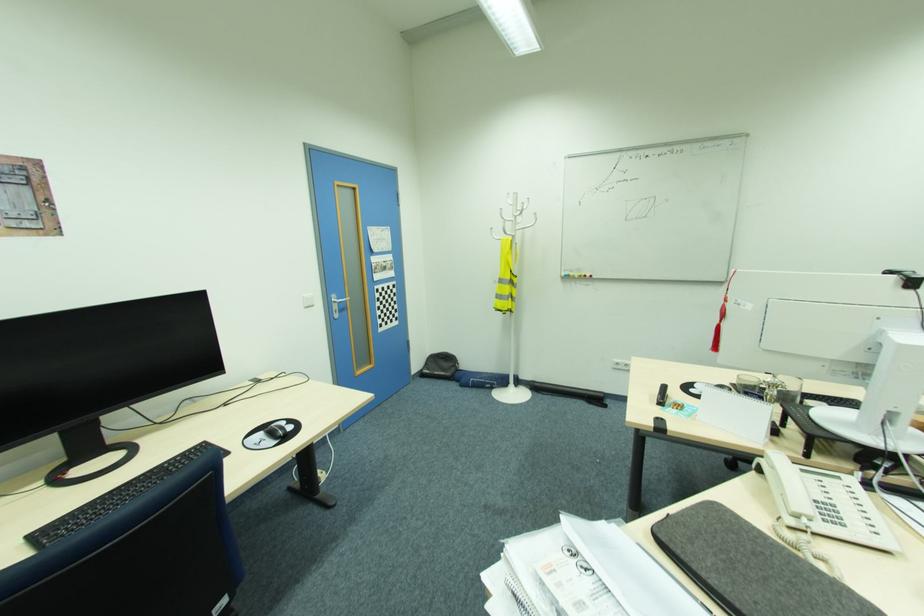
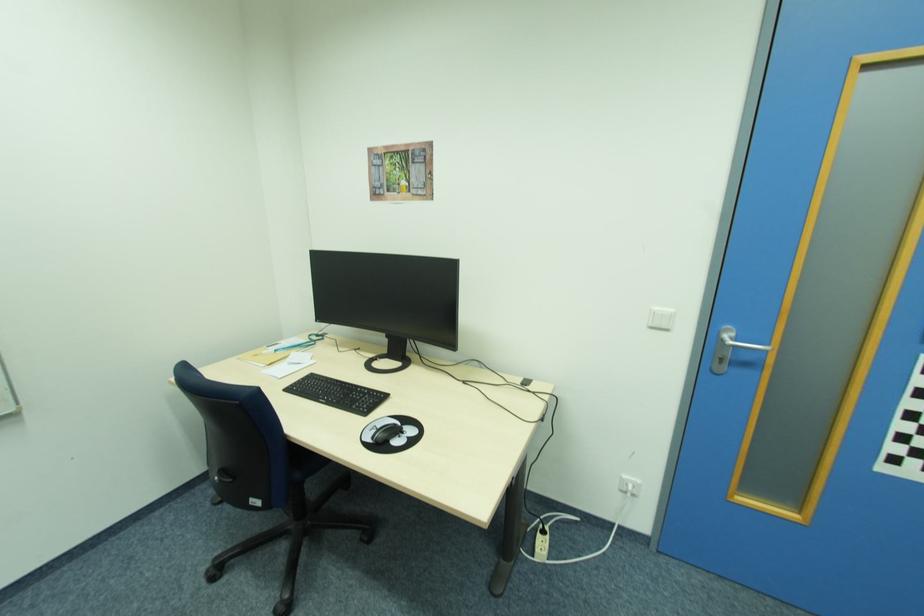
In the second image, find the point that corresponds to (x=278, y=442) in the first image.

(372, 440)